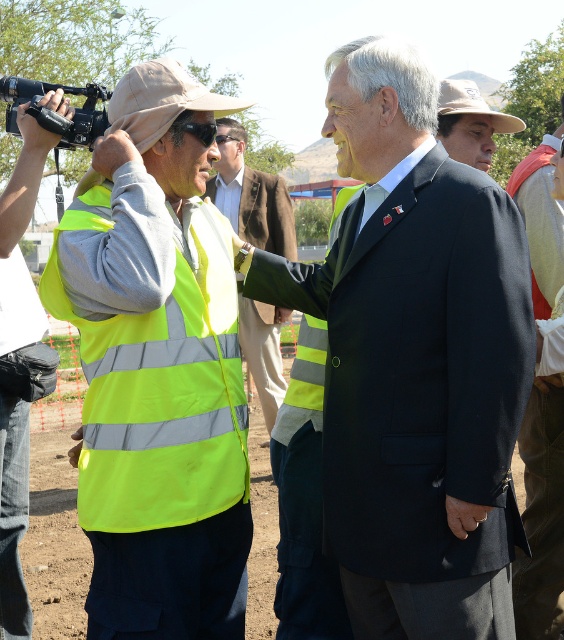
Question: Can you confirm if black suit at center is wider than khaki fabric hat at center?

Choices:
 (A) yes
 (B) no

Answer: (A)

Question: Considering the real-world distances, which object is farthest from the black plastic video camera at upper left?

Choices:
 (A) black suit at center
 (B) high-visibility fabric safety vest at left
 (C) khaki fabric hat at center

Answer: (C)

Question: Can you confirm if khaki fabric hat at center is bigger than black plastic video camera at upper left?

Choices:
 (A) no
 (B) yes

Answer: (A)

Question: Which point appears farthest from the camera in this image?

Choices:
 (A) click(x=271, y=413)
 (B) click(x=488, y=116)
 (C) click(x=55, y=88)
 (D) click(x=482, y=304)

Answer: (A)

Question: Which point appears closest to the camera in this image?

Choices:
 (A) (231, 493)
 (B) (64, 145)
 (C) (241, 154)
 (D) (462, 253)

Answer: (D)

Question: Can you confirm if high-visibility fabric safety vest at left is positioned below black plastic video camera at upper left?

Choices:
 (A) no
 (B) yes

Answer: (B)